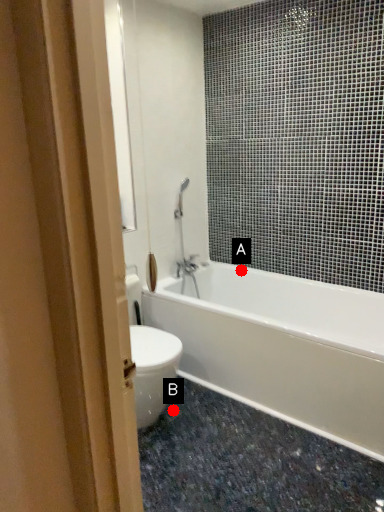
Question: Two points are circled on the image, labeled by A and B beside each circle. Which point is farther from the camera taking this photo?

Choices:
 (A) A is further
 (B) B is further

Answer: (A)